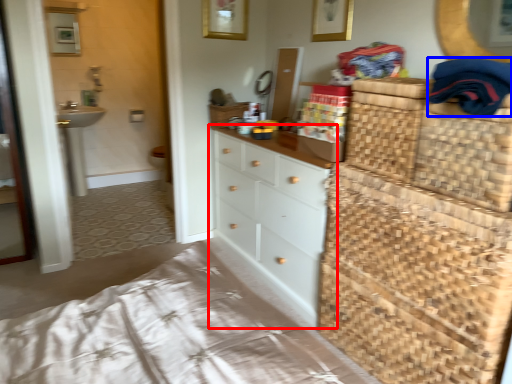
Question: Which object appears closest to the camera in this image, chest of drawers (highlighted by a red box) or clothing (highlighted by a blue box)?

Choices:
 (A) chest of drawers
 (B) clothing

Answer: (B)